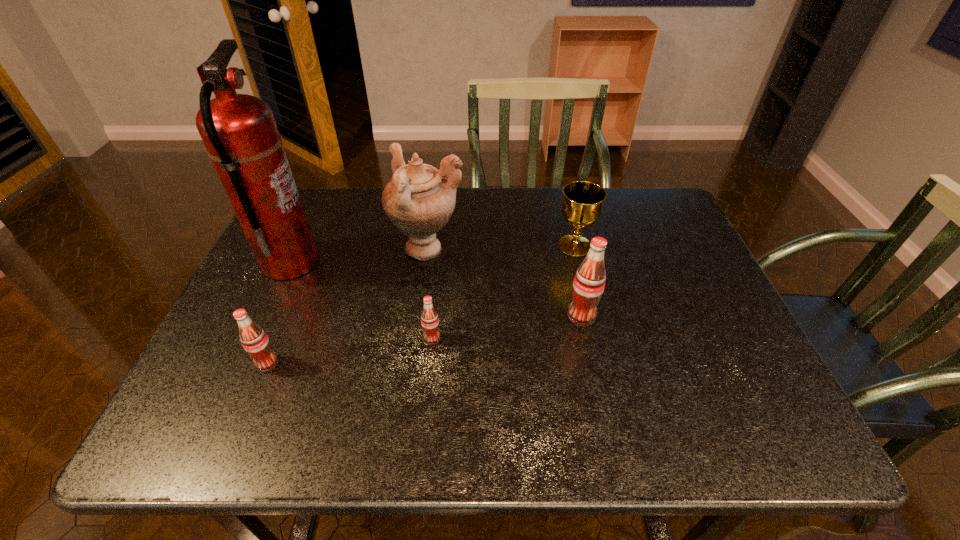
Locate an element on the screen. This screenshot has width=960, height=540. vacant region located on the left of the shortest soda is located at coordinates (272, 339).

Find the location of a particular element. This screenshot has height=540, width=960. free space located on the left of the third nearest object is located at coordinates (538, 316).

The image size is (960, 540). Find the location of `free location located on the front of the fifth shortest object`. free location located on the front of the fifth shortest object is located at coordinates (412, 372).

Where is `vacant region located on the nozzle side of the fire extinguisher`? This screenshot has width=960, height=540. vacant region located on the nozzle side of the fire extinguisher is located at coordinates (435, 263).

You are a GUI agent. You are given a task and a screenshot of the screen. Output one action in this format:
    pyautogui.click(x=<x>, y=<y>)
    Task: Click on the vacant space located on the front of the chalice
    
    Given the screenshot: What is the action you would take?
    pyautogui.click(x=590, y=312)

Where is `urn present at the far edge`? This screenshot has height=540, width=960. urn present at the far edge is located at coordinates (418, 200).

This screenshot has width=960, height=540. Identify the location of chalice that is at the far edge. (583, 200).

The width and height of the screenshot is (960, 540). In order to click on object present at the near edge in this screenshot , I will do `click(254, 340)`.

Identify the location of soda situated at the left edge. (254, 340).

Identify the location of fire extinguisher located in the left edge section of the desktop. The image size is (960, 540). (239, 131).